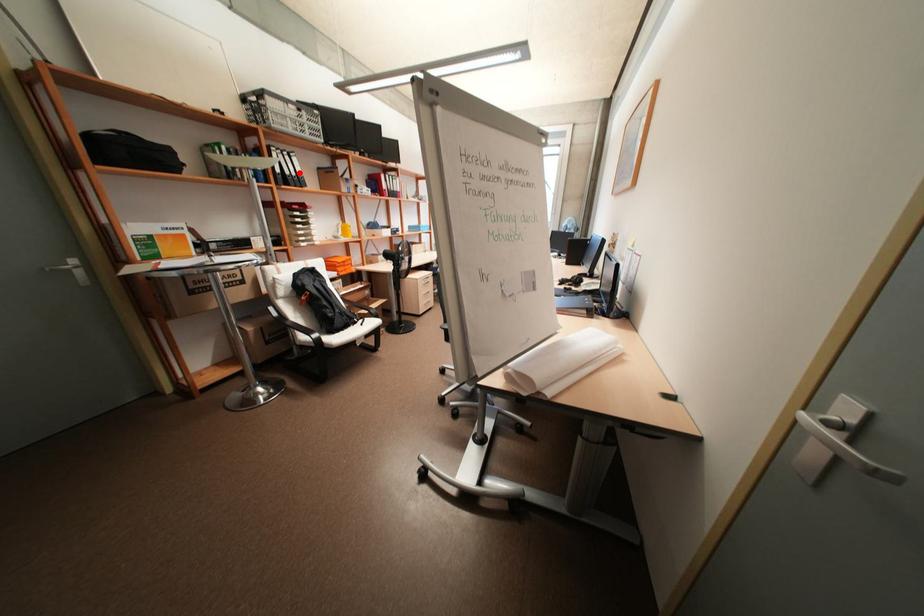
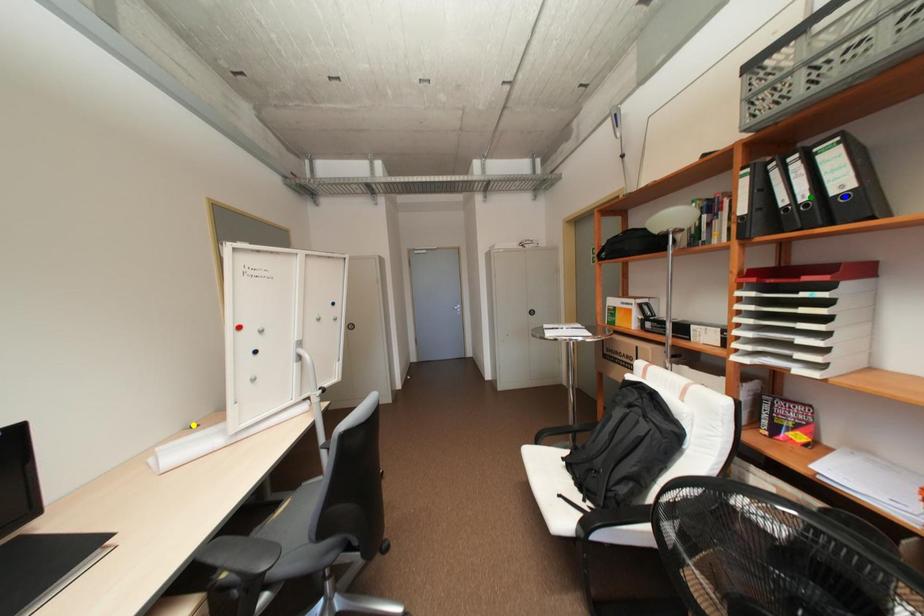
Question: I am providing you with two images of the same scene from different viewpoints. A red point is marked on the first image. You are given multiple points on the second image. Which point in image 2 is actually the same real-world point as the red point in image 1?

Choices:
 (A) green point
 (B) blue point
 (C) yellow point

Answer: (A)